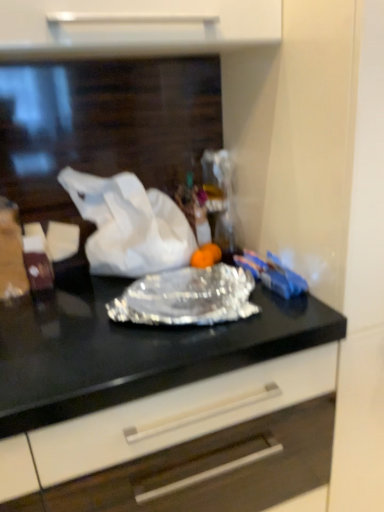
Question: Is there a large distance between white paper at center and silver foil wrap at center?

Choices:
 (A) no
 (B) yes

Answer: (A)

Question: Is white paper at center thinner than silver foil wrap at center?

Choices:
 (A) no
 (B) yes

Answer: (B)

Question: Is silver foil wrap at center at the back of white paper at center?

Choices:
 (A) no
 (B) yes

Answer: (A)

Question: Is white paper at center closer to camera compared to silver foil wrap at center?

Choices:
 (A) yes
 (B) no

Answer: (B)

Question: Does white paper at center appear on the right side of silver foil wrap at center?

Choices:
 (A) no
 (B) yes

Answer: (A)

Question: Is white paper at center facing towards silver foil wrap at center?

Choices:
 (A) no
 (B) yes

Answer: (B)

Question: Is silver foil wrap at center to the left of shiny metallic foil at center from the viewer's perspective?

Choices:
 (A) yes
 (B) no

Answer: (B)

Question: Is silver foil wrap at center turned away from shiny metallic foil at center?

Choices:
 (A) yes
 (B) no

Answer: (B)

Question: Is silver foil wrap at center not near shiny metallic foil at center?

Choices:
 (A) yes
 (B) no

Answer: (B)

Question: From the image's perspective, does silver foil wrap at center appear lower than shiny metallic foil at center?

Choices:
 (A) no
 (B) yes

Answer: (A)

Question: Is silver foil wrap at center at the right side of shiny metallic foil at center?

Choices:
 (A) no
 (B) yes

Answer: (B)

Question: Is silver foil wrap at center bigger than shiny metallic foil at center?

Choices:
 (A) no
 (B) yes

Answer: (A)

Question: Considering the relative sizes of shiny metallic foil at center and silver foil wrap at center in the image provided, is shiny metallic foil at center bigger than silver foil wrap at center?

Choices:
 (A) no
 (B) yes

Answer: (B)